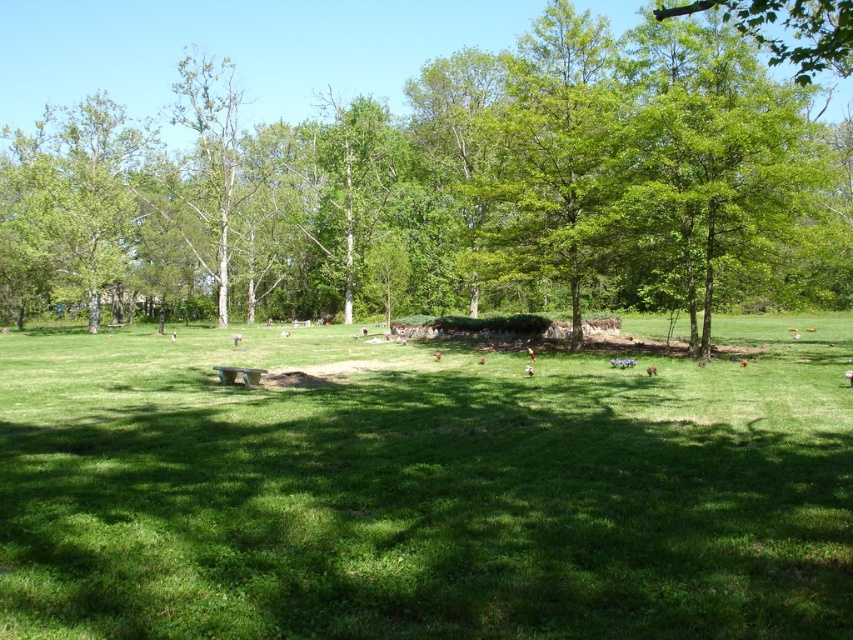
You are standing in the park and want to take a photo of the green leafy tree at upper right. To ensure it is the main focus, where should you position yourself relative to the green grassy area at center?

You should position yourself behind the green grassy area at center so that the green leafy tree at upper right is in the background, making it the main focus of the photo.

You are standing at the point marked as point [460,184] in the image. What is directly above you?

The point [460,184] is on green leafy tree at center, so the green leafy tree at center is directly above you.